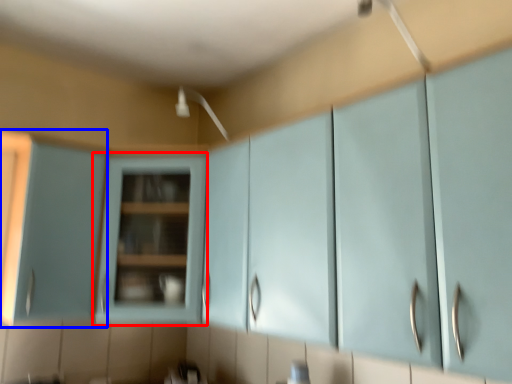
Question: Which object appears closest to the camera in this image, cabinetry (highlighted by a red box) or cabinetry (highlighted by a blue box)?

Choices:
 (A) cabinetry
 (B) cabinetry

Answer: (A)